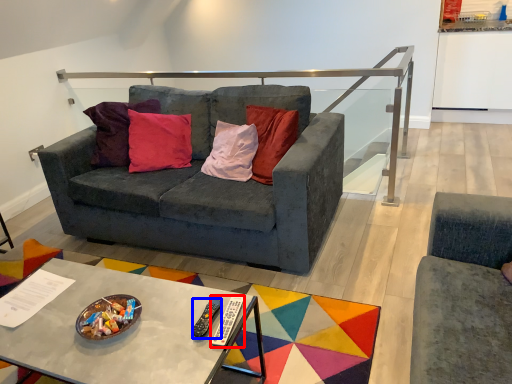
Question: Which of the following is the farthest to the observer, remote (highlighted by a red box) or remote (highlighted by a blue box)?

Choices:
 (A) remote
 (B) remote

Answer: (B)